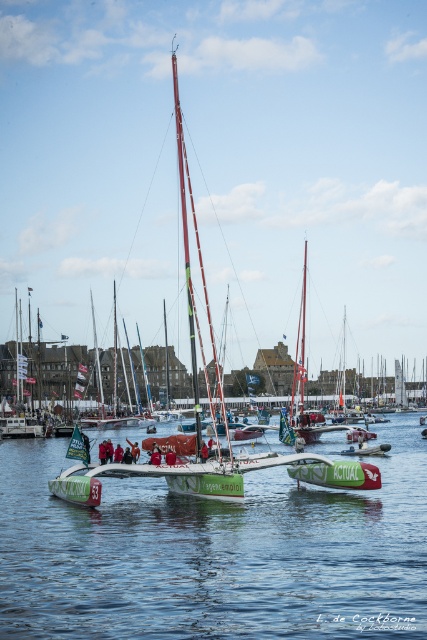
Measure the distance between green glossy water at center and green matte sailboat at center.

They are 25.98 meters apart.

Is green glossy water at center to the right of green matte sailboat at center from the viewer's perspective?

Correct, you'll find green glossy water at center to the right of green matte sailboat at center.

Who is more distant from viewer, (408, 516) or (198, 337)?

Point (198, 337)

Locate an element on the screen. green glossy water at center is located at coordinates (215, 554).